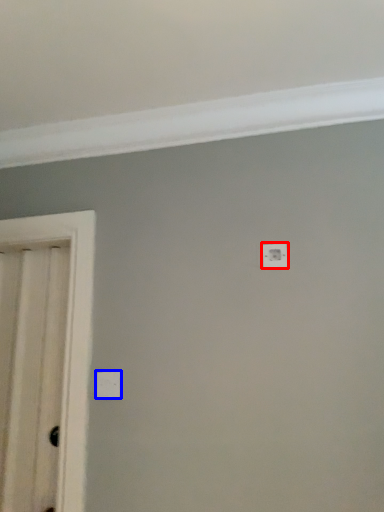
Question: Which object is further to the camera taking this photo, light switch (highlighted by a red box) or light switch (highlighted by a blue box)?

Choices:
 (A) light switch
 (B) light switch

Answer: (A)